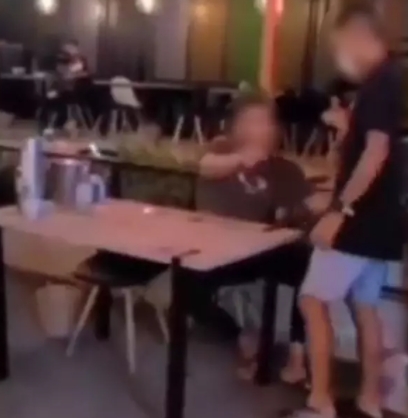
Where is `table`? The width and height of the screenshot is (408, 418). table is located at coordinates (114, 222).